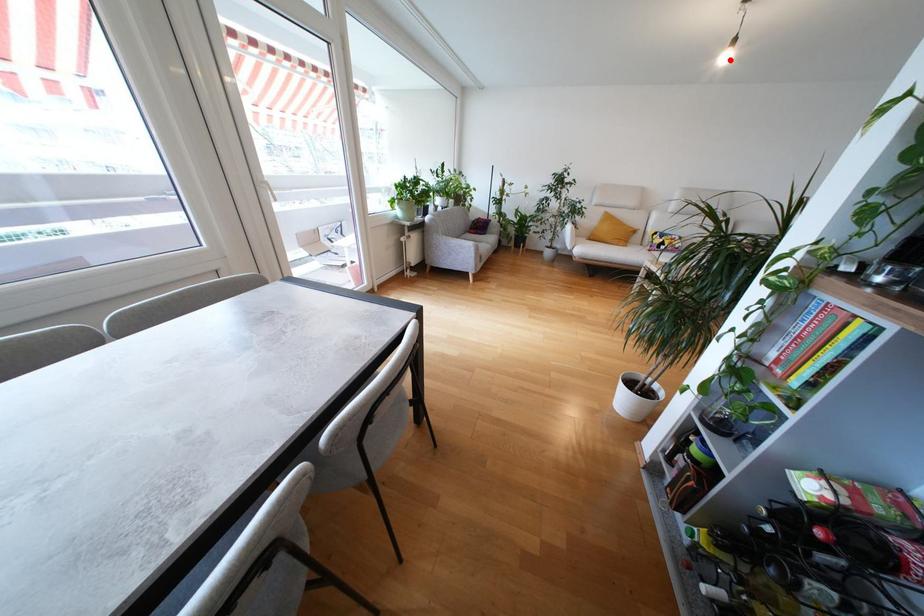
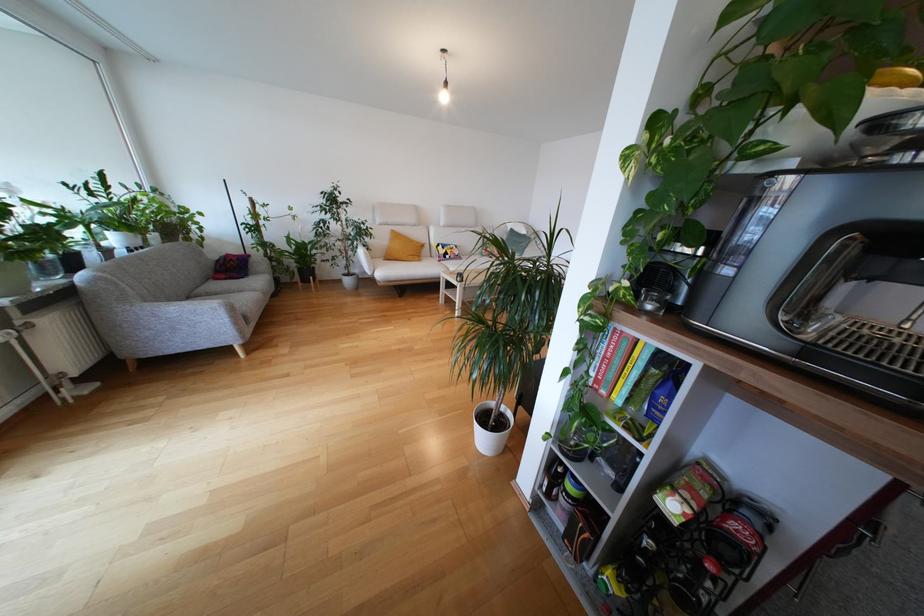
Question: I am providing you with two images of the same scene from different viewpoints. A red point is marked on the first image. Is the red point's position out of view in image 2?

Choices:
 (A) Yes
 (B) No

Answer: (B)